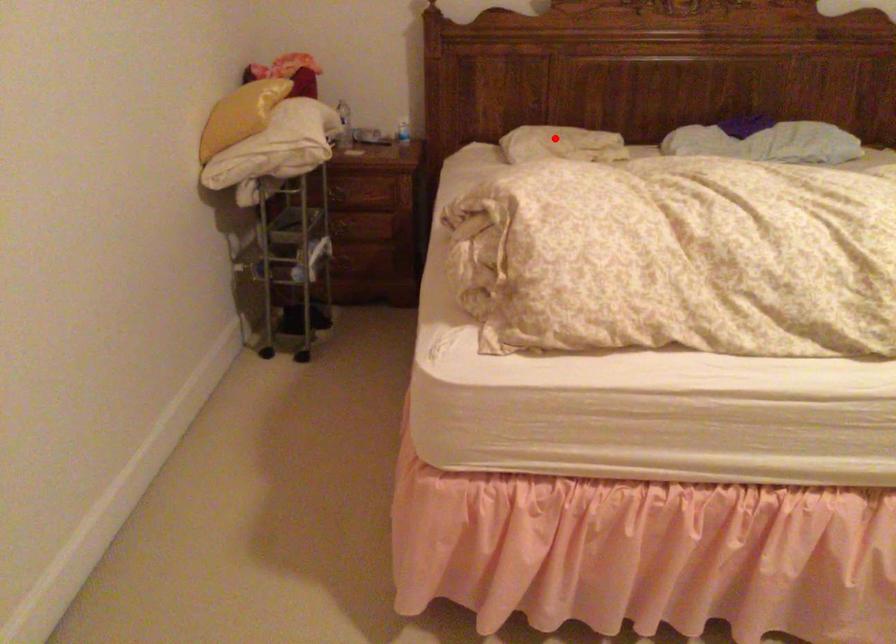
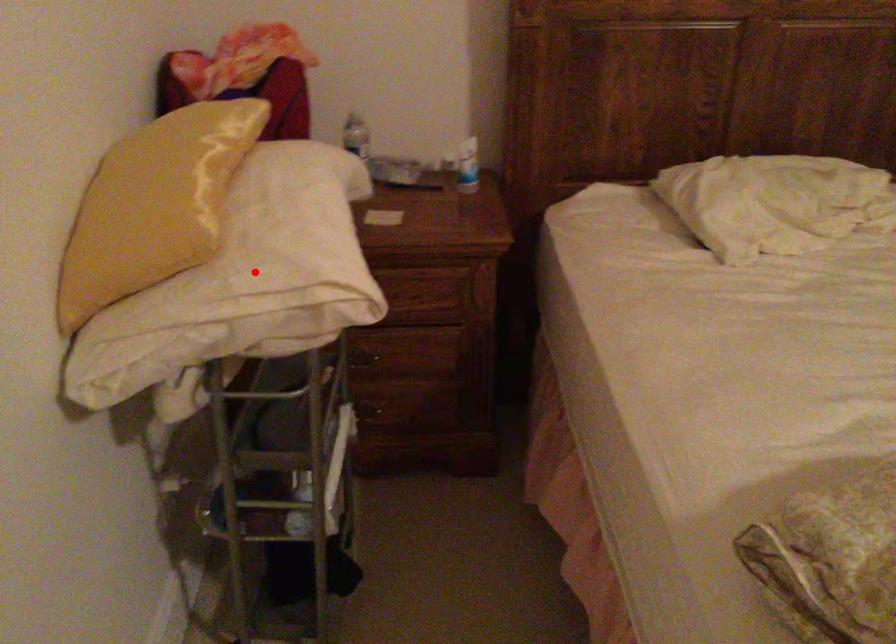
I am providing you with two images of the same scene from different viewpoints. A red point is marked on the first image and another point is marked on the second image. Is the red point in image1 aligned with the point shown in image2?

No